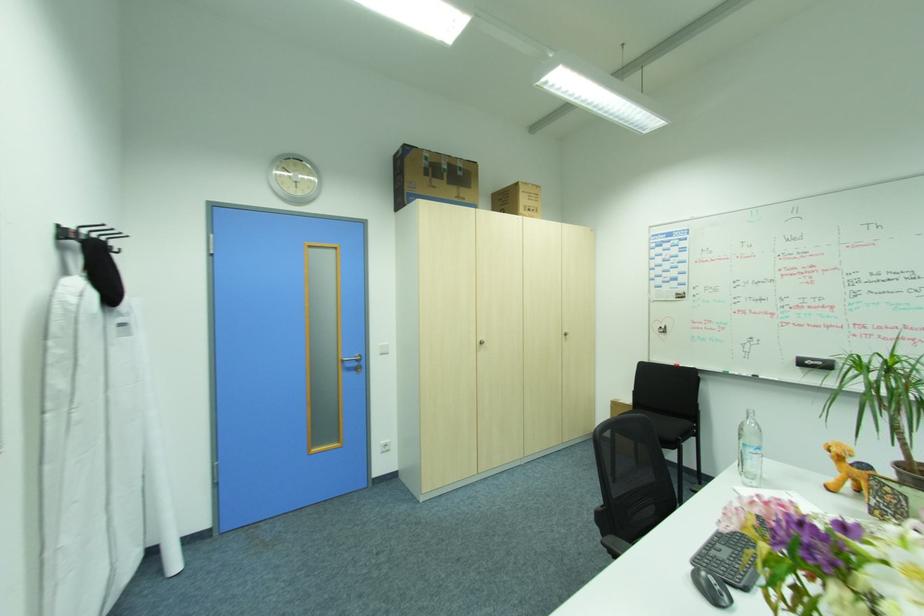
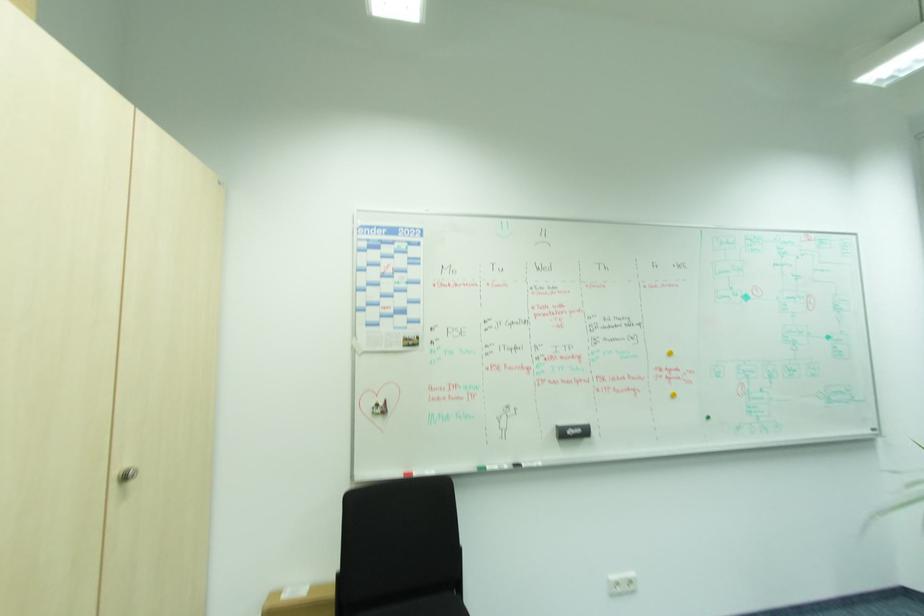
In the second image, find the point that corresponds to pixel 824 363 in the first image.

(584, 430)